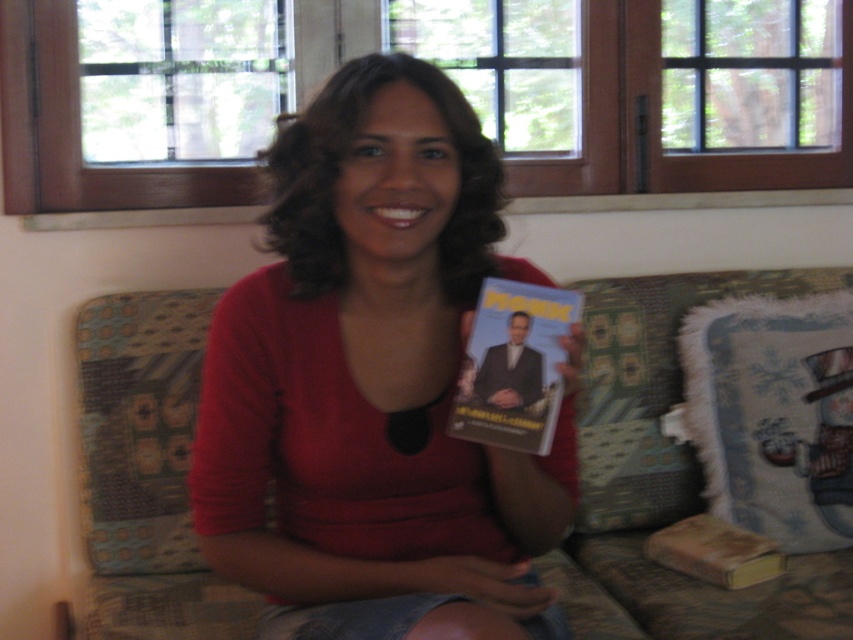
Based on the photo, you are a photographer setting up a shoot. You need to place a 12 inch wide prop between the matte red shirt at center and the white fluffy pillow at upper right. Is there enough space to fit it without overlapping either object?

The distance between the matte red shirt at center and the white fluffy pillow at upper right is 28.77 inches. Since the prop is 12 inches wide, there is sufficient space to place it between them without overlapping either object.

You are a delivery person who needs to place a small package between the white glossy dvd at center and the brown leather book at lower right. Can you fit it there if the package is 60 centimeters long?

The distance between the white glossy dvd at center and the brown leather book at lower right is 68.88 centimeters. Since the package is 60 centimeters long, it can fit in the space between them as there is enough room.

You are a tailor measuring the distance between the matte red shirt at center and the patterned fabric couch at center for a new design. Can you fit a 20 inch long ruler between them?

The distance between the matte red shirt at center and the patterned fabric couch at center is 22.63 inches, so yes, a 20 inch long ruler can fit between them since it is shorter than the available space.